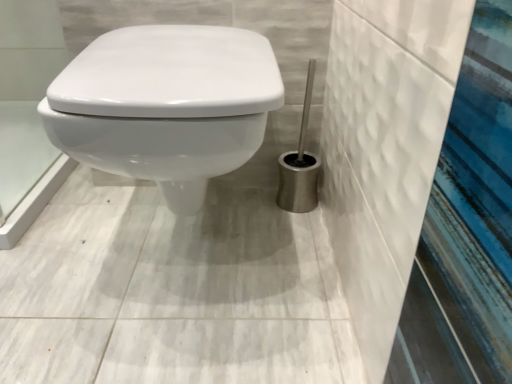
Locate an element on the screen. This screenshot has height=384, width=512. vacant region under white glossy toilet at center (from a real-world perspective) is located at coordinates (188, 260).